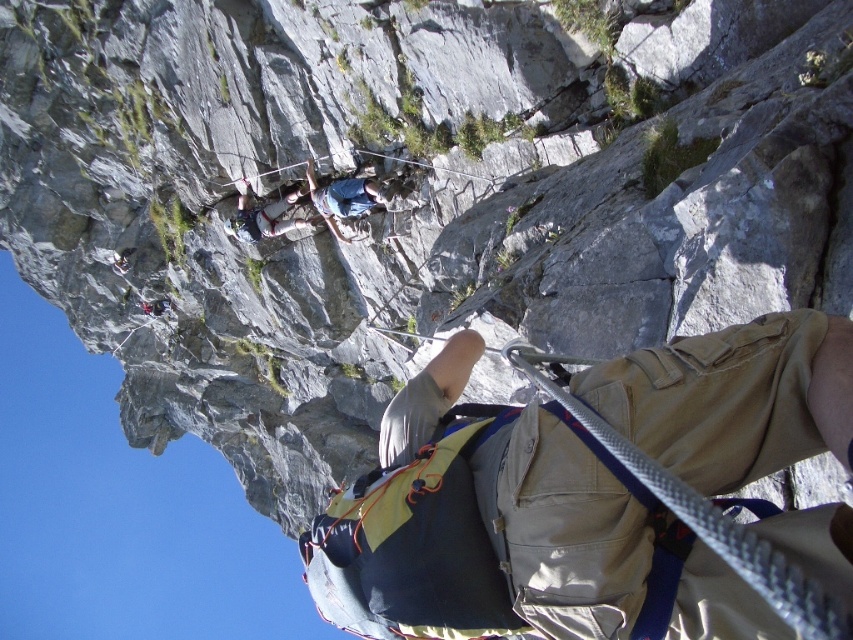
You are a rock climber preparing to ascend the cliff. You notice a tan fabric backpack at center and a blue fabric shirt at upper center. Which object is positioned higher up the cliff?

The blue fabric shirt at upper center is positioned higher up the cliff than the tan fabric backpack at center.

From the picture: You are a climber preparing to ascend a steep cliff. You have a tan fabric backpack at center. Where is the tan fabric backpack located in terms of coordinates?

The tan fabric backpack at center is located at coordinates point (511, 532).

You are a climber planning to ascend the cliff. You have a tan fabric backpack at center and a blue fabric shirt at upper center in your view. Which item is farther from you?

The tan fabric backpack at center is 26.77 meters away from the blue fabric shirt at upper center, so the tan fabric backpack at center is farther away from you than the blue fabric shirt at upper center.